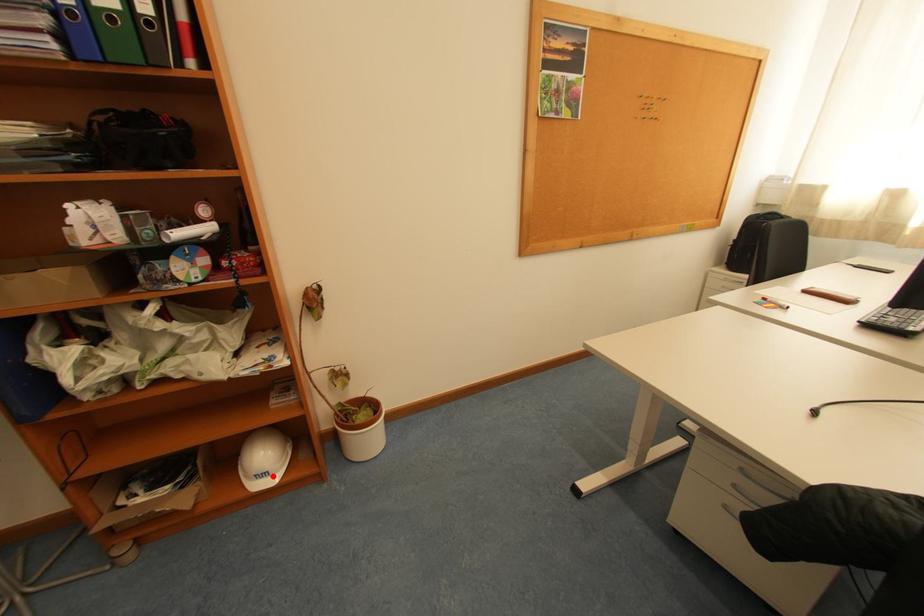
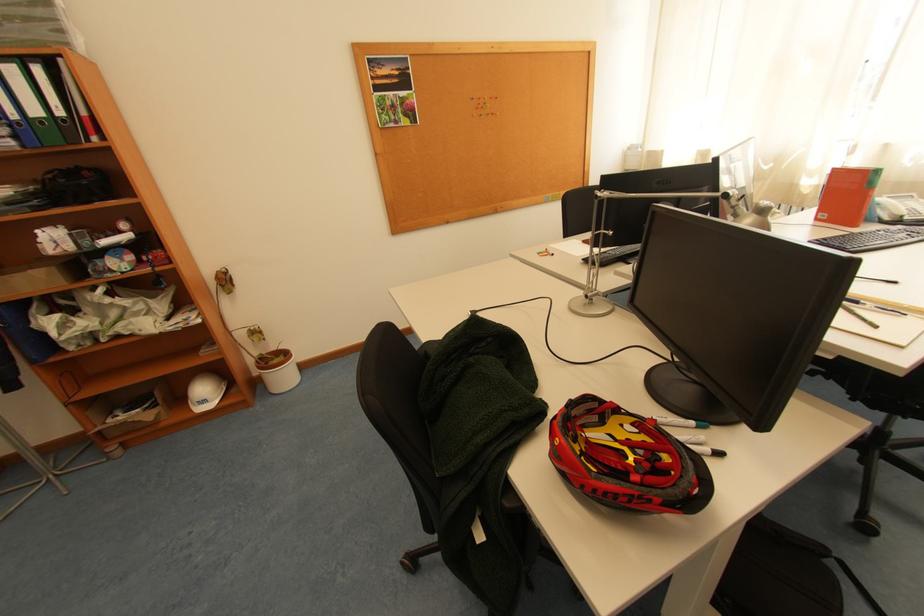
Locate, in the second image, the point that corresponds to the highlighted location in the first image.

(213, 402)